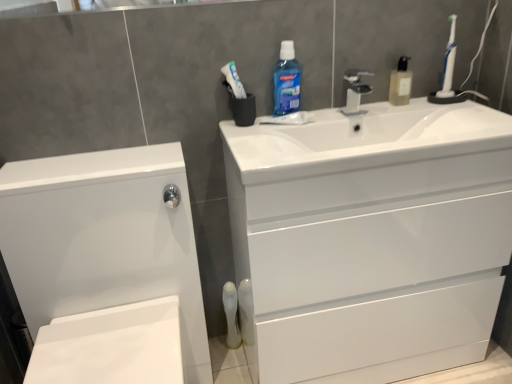
Question: Considering the relative sizes of white plastic toothbrush at upper right and white glossy cabinet at lower left in the image provided, is white plastic toothbrush at upper right shorter than white glossy cabinet at lower left?

Choices:
 (A) yes
 (B) no

Answer: (A)

Question: Can you see white plastic toothbrush at upper right touching white glossy cabinet at lower left?

Choices:
 (A) no
 (B) yes

Answer: (A)

Question: Considering the relative positions of white plastic toothbrush at upper right and white glossy cabinet at lower left in the image provided, is white plastic toothbrush at upper right in front of white glossy cabinet at lower left?

Choices:
 (A) no
 (B) yes

Answer: (A)

Question: Can you confirm if white plastic toothbrush at upper right is taller than white glossy cabinet at lower left?

Choices:
 (A) no
 (B) yes

Answer: (A)

Question: Could you tell me if white plastic toothbrush at upper right is facing white glossy cabinet at lower left?

Choices:
 (A) no
 (B) yes

Answer: (A)

Question: Do you think translucent plastic mouthwash at lower center is within white glossy drawer at center, or outside of it?

Choices:
 (A) inside
 (B) outside

Answer: (B)

Question: From the image's perspective, relative to white glossy drawer at center, is translucent plastic mouthwash at lower center above or below?

Choices:
 (A) below
 (B) above

Answer: (A)

Question: From a real-world perspective, is translucent plastic mouthwash at lower center above or below white glossy drawer at center?

Choices:
 (A) above
 (B) below

Answer: (B)

Question: Relative to white glossy drawer at center, is translucent plastic mouthwash at lower center in front or behind?

Choices:
 (A) front
 (B) behind

Answer: (B)

Question: From the image's perspective, is satin nickel faucet at center positioned above or below blue translucent liquid at upper center, the first cleaning product viewed from the left?

Choices:
 (A) above
 (B) below

Answer: (B)

Question: From a real-world perspective, relative to blue translucent liquid at upper center, the first cleaning product viewed from the left, is satin nickel faucet at center vertically above or below?

Choices:
 (A) above
 (B) below

Answer: (B)

Question: Is point (347, 82) positioned closer to the camera than point (289, 102)?

Choices:
 (A) farther
 (B) closer

Answer: (A)

Question: Is satin nickel faucet at center bigger or smaller than blue translucent liquid at upper center, the first cleaning product viewed from the left?

Choices:
 (A) big
 (B) small

Answer: (B)

Question: Considering the positions of point (409, 74) and point (349, 102), is point (409, 74) closer or farther from the camera than point (349, 102)?

Choices:
 (A) farther
 (B) closer

Answer: (B)

Question: Is translucent plastic soap dispenser at upper right, the 1th cleaning product from the right, wider or thinner than satin nickel faucet at center?

Choices:
 (A) wide
 (B) thin

Answer: (A)